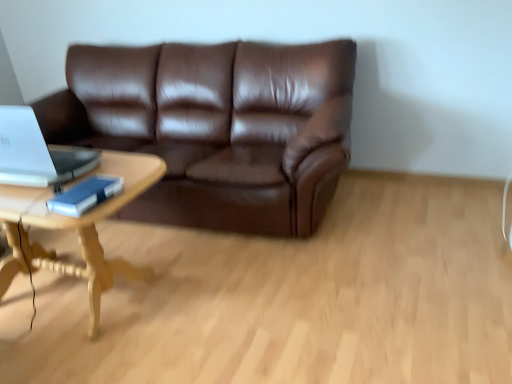
Question: Can you confirm if brown leather couch at center is taller than blue matte book at left?

Choices:
 (A) no
 (B) yes

Answer: (B)

Question: From the image's perspective, does brown leather couch at center appear higher than blue matte book at left?

Choices:
 (A) yes
 (B) no

Answer: (A)

Question: Is blue matte book at left at the back of brown leather couch at center?

Choices:
 (A) no
 (B) yes

Answer: (A)

Question: Is brown leather couch at center behind blue matte book at left?

Choices:
 (A) yes
 (B) no

Answer: (A)

Question: Is brown leather couch at center bigger than blue matte book at left?

Choices:
 (A) yes
 (B) no

Answer: (A)

Question: Can you confirm if brown leather couch at center is positioned to the left of blue matte book at left?

Choices:
 (A) no
 (B) yes

Answer: (A)

Question: Is the surface of blue matte book at left in direct contact with brown leather couch at center?

Choices:
 (A) yes
 (B) no

Answer: (B)

Question: Does blue matte book at left have a larger size compared to brown leather couch at center?

Choices:
 (A) yes
 (B) no

Answer: (B)

Question: From a real-world perspective, is blue matte book at left positioned over brown leather couch at center based on gravity?

Choices:
 (A) yes
 (B) no

Answer: (A)

Question: From the image's perspective, is blue matte book at left beneath brown leather couch at center?

Choices:
 (A) no
 (B) yes

Answer: (B)

Question: Could you tell me if blue matte book at left is turned towards brown leather couch at center?

Choices:
 (A) no
 (B) yes

Answer: (A)

Question: Does blue matte book at left come in front of brown leather couch at center?

Choices:
 (A) no
 (B) yes

Answer: (B)

Question: Can you confirm if blue matte book at left is bigger than silver metallic laptop at left?

Choices:
 (A) yes
 (B) no

Answer: (B)